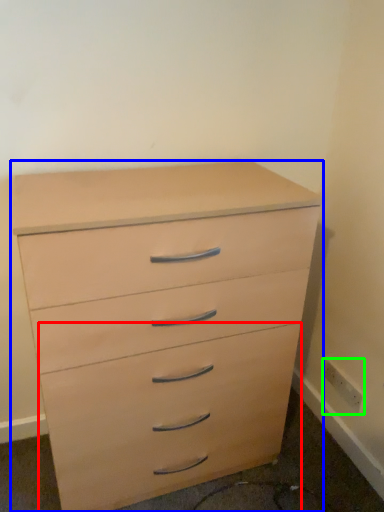
Question: Estimate the real-world distances between objects in this image. Which object is closer to drawer (highlighted by a red box), chest of drawers (highlighted by a blue box) or electric outlet (highlighted by a green box)?

Choices:
 (A) chest of drawers
 (B) electric outlet

Answer: (A)